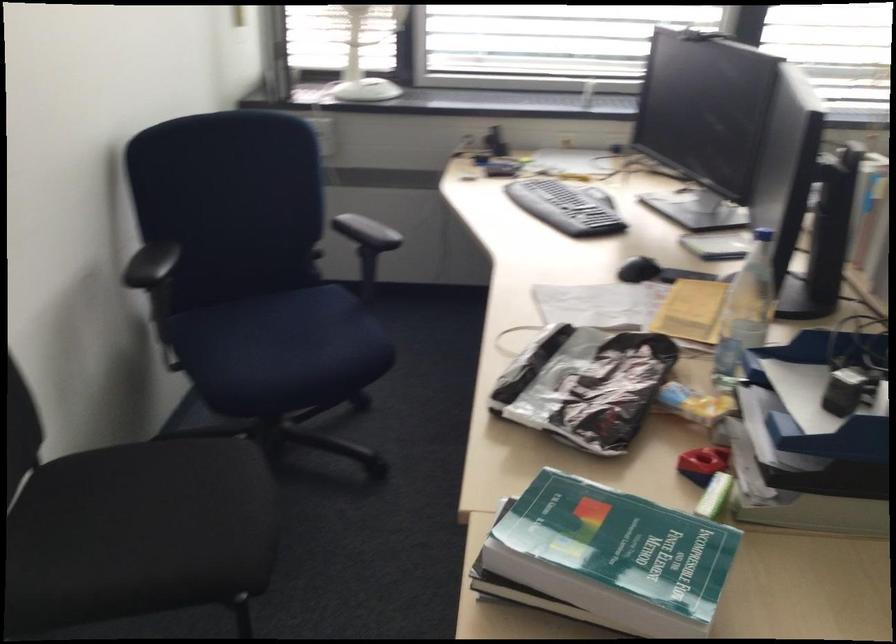
Which object does [639,269] point to?

It refers to a black computer mouse.